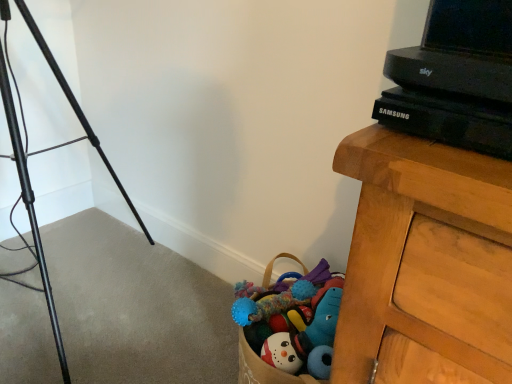
Where is `vacant area situated below black metal tripod at left (from a real-world perspective)`? This screenshot has height=384, width=512. vacant area situated below black metal tripod at left (from a real-world perspective) is located at coordinates (72, 321).